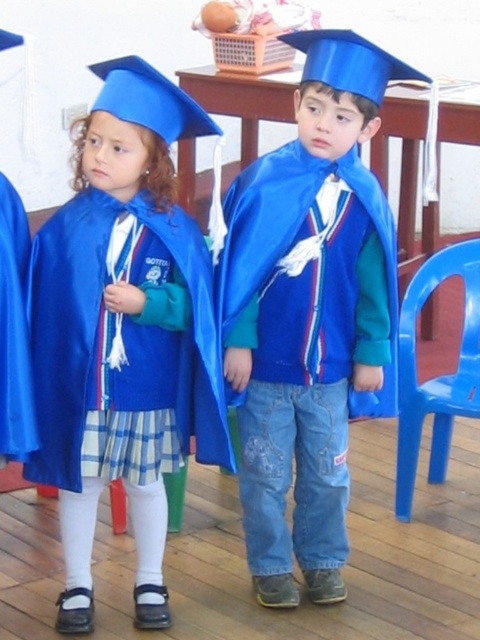
Can you confirm if shiny blue graduation gown at center is smaller than matte blue graduation gown at center?

Incorrect, shiny blue graduation gown at center is not smaller in size than matte blue graduation gown at center.

Where is `shiny blue graduation gown at center`? This screenshot has height=640, width=480. shiny blue graduation gown at center is located at coordinates point(310,314).

You are a GUI agent. You are given a task and a screenshot of the screen. Output one action in this format:
    pyautogui.click(x=<x>, y=<y>)
    Task: Click on the shiny blue graduation gown at center
    
    Given the screenshot: What is the action you would take?
    (x=310, y=314)

Does shiny blue graduation gown at center come behind blue plastic chair at lower right?

That is False.

Measure the distance between shiny blue graduation gown at center and camera.

They are 7.10 feet apart.

Identify the location of shiny blue graduation gown at center. (310, 314).

From the picture: Is matte blue graduation gown at center above blue plastic chair at lower right?

Correct, matte blue graduation gown at center is located above blue plastic chair at lower right.

Who is higher up, matte blue graduation gown at center or blue plastic chair at lower right?

matte blue graduation gown at center

Who is more forward, [111,106] or [468,326]?

Point [111,106] is more forward.

The image size is (480, 640). I want to click on matte blue graduation gown at center, so click(121, 332).